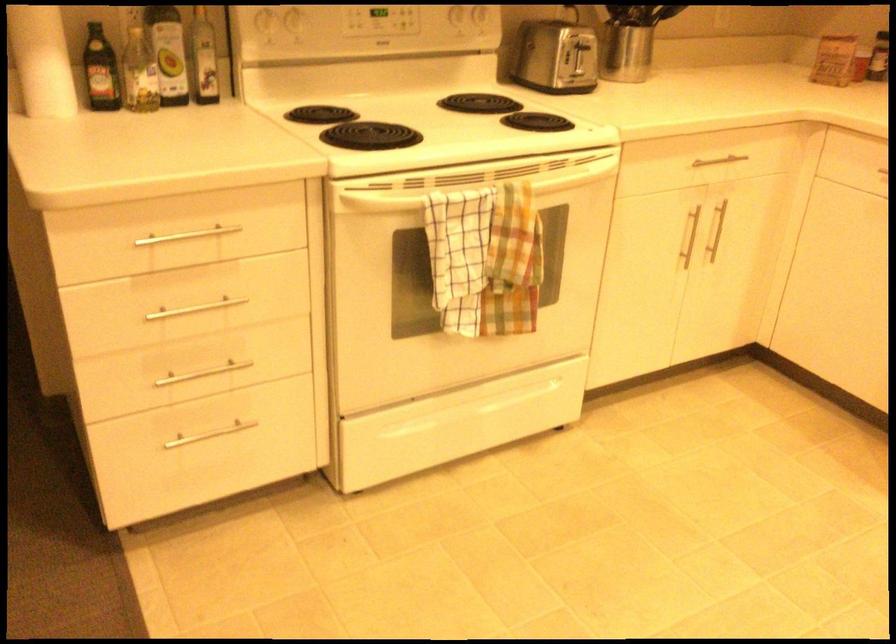
Locate an element on the screen. dark glass bottle is located at coordinates (100, 71).